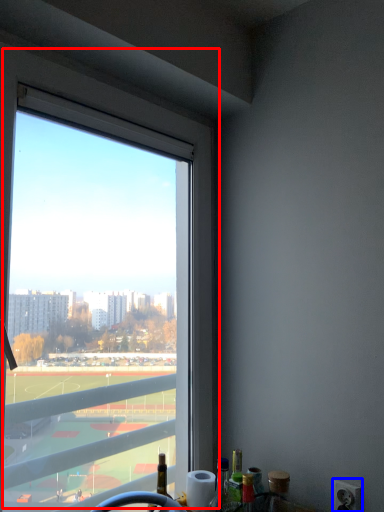
Question: Which of the following is the closest to the observer, window (highlighted by a red box) or power outlet (highlighted by a blue box)?

Choices:
 (A) window
 (B) power outlet

Answer: (A)